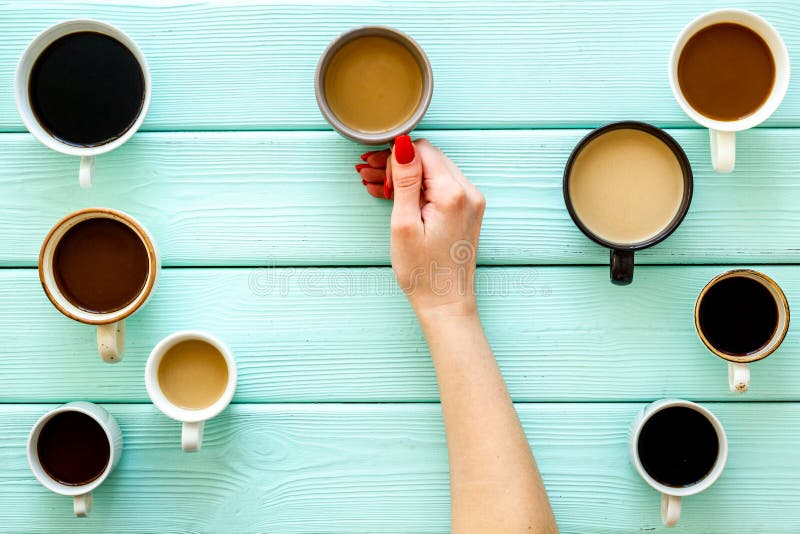
At what (x,y) coordinates should I click in order to perform the action: click on coffee cup handles. Please return your answer as a coordinate pair (x, y). The image size is (800, 534). Looking at the image, I should click on (728, 148), (626, 273), (738, 376), (673, 511), (193, 437), (80, 505), (110, 342), (86, 172).